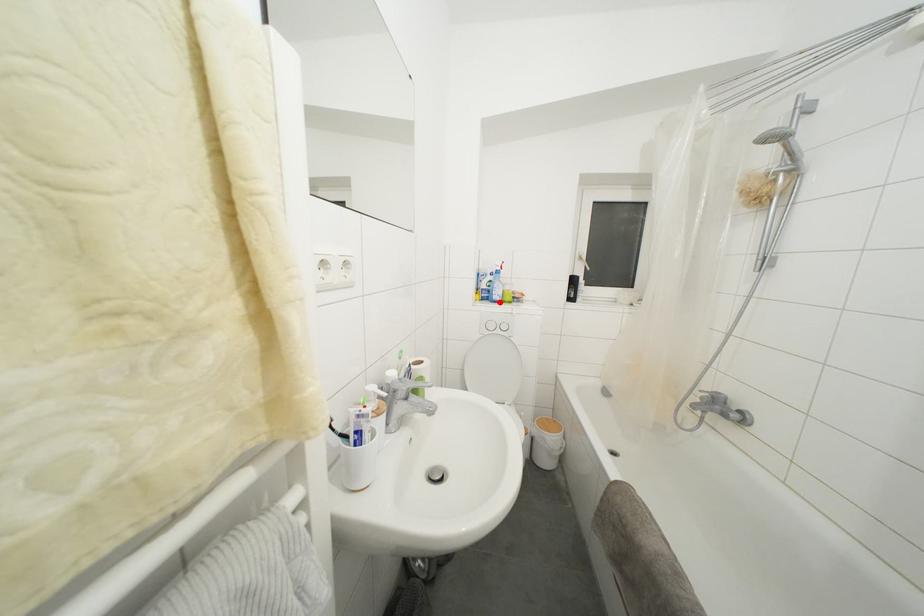
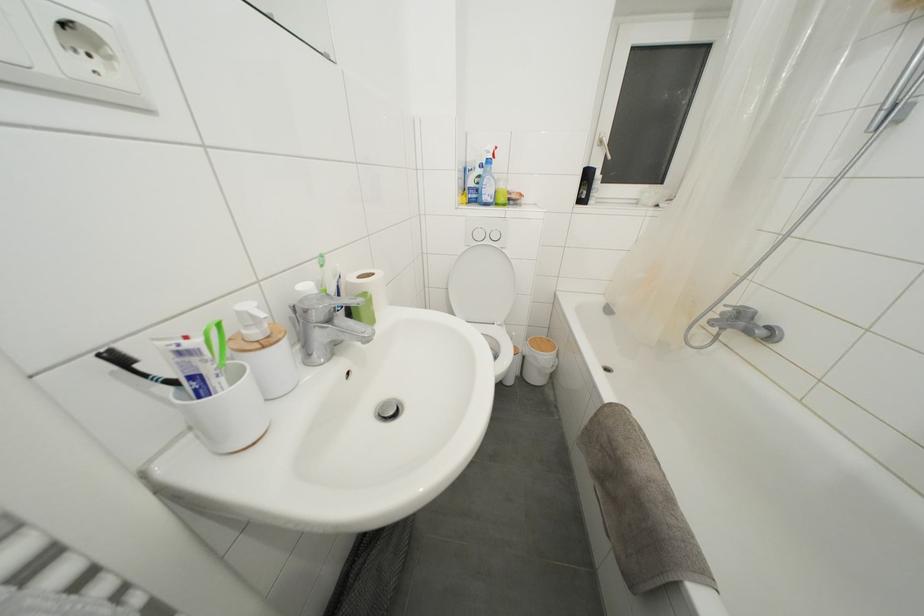
Question: I am providing you with two images of the same scene from different viewpoints. Given a red point in image1, look at the same physical point in image2. Is it:

Choices:
 (A) Closer to the viewpoint
 (B) Farther from the viewpoint

Answer: (A)